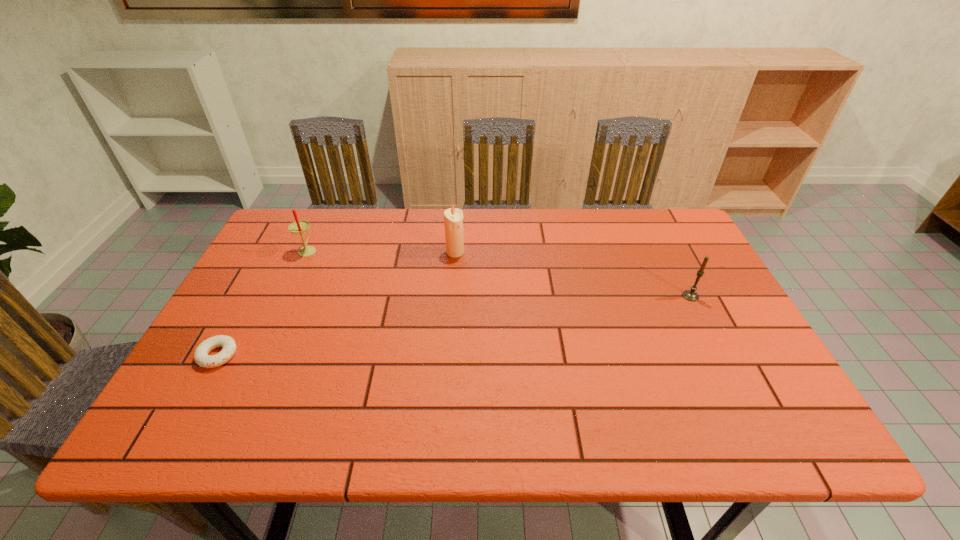
Identify the location of the second candle from right to left. (453, 218).

This screenshot has height=540, width=960. I want to click on the leftmost candle, so click(300, 226).

Identify the location of the nearest candle. (691, 295).

The height and width of the screenshot is (540, 960). In order to click on the rightmost candle in this screenshot , I will do `click(691, 295)`.

The height and width of the screenshot is (540, 960). I want to click on the shortest object, so click(201, 357).

The height and width of the screenshot is (540, 960). I want to click on the nearest object, so click(201, 357).

Identify the location of vacant area situated 0.250m on the left of the second candle from right to left. The image size is (960, 540). (363, 252).

In order to click on free space located on the left of the second object from left to right in this screenshot , I will do `click(265, 250)`.

Find the location of a particular element. The width and height of the screenshot is (960, 540). vacant space positioned on the back of the nearest candle is located at coordinates (665, 245).

I want to click on vacant region located 0.140m on the right of the shortest object, so click(x=297, y=355).